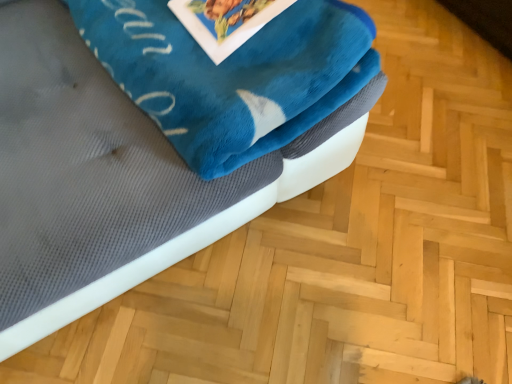
Question: Is blue plush bath towel at upper left wider or thinner than velvety blue blanket at upper left?

Choices:
 (A) thin
 (B) wide

Answer: (A)

Question: Would you say blue plush bath towel at upper left is inside or outside velvety blue blanket at upper left?

Choices:
 (A) outside
 (B) inside

Answer: (B)

Question: In the image, is blue plush bath towel at upper left on the left side or the right side of velvety blue blanket at upper left?

Choices:
 (A) left
 (B) right

Answer: (B)

Question: Is velvety blue blanket at upper left taller or shorter than blue plush bath towel at upper left?

Choices:
 (A) short
 (B) tall

Answer: (B)

Question: Considering the positions of velvety blue blanket at upper left and blue plush bath towel at upper left in the image, is velvety blue blanket at upper left bigger or smaller than blue plush bath towel at upper left?

Choices:
 (A) small
 (B) big

Answer: (B)

Question: Considering the positions of point (115, 158) and point (77, 21), is point (115, 158) closer or farther from the camera than point (77, 21)?

Choices:
 (A) closer
 (B) farther

Answer: (A)

Question: From a real-world perspective, relative to blue plush bath towel at upper left, is velvety blue blanket at upper left vertically above or below?

Choices:
 (A) below
 (B) above

Answer: (A)